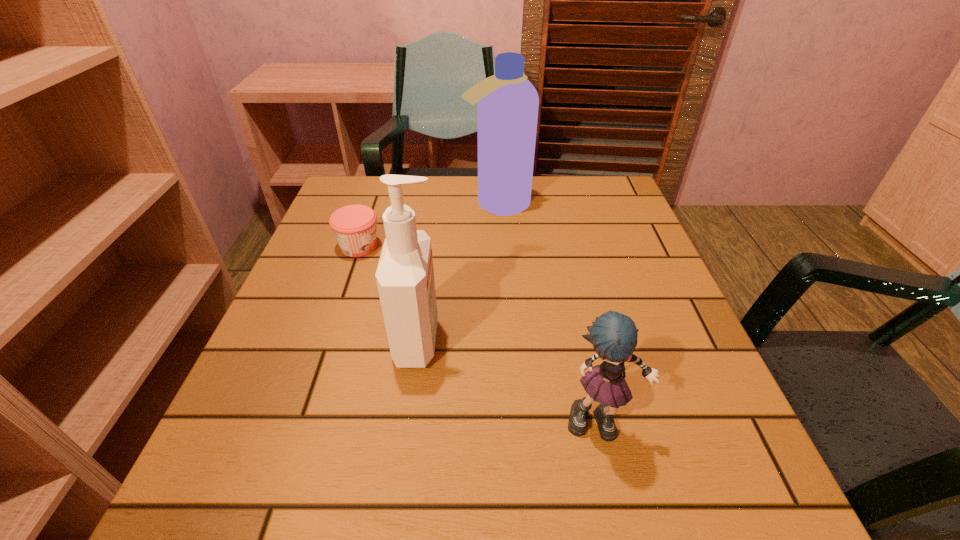
Locate an element on the screen. The image size is (960, 540). free space between the farthest object and the third farthest object is located at coordinates (458, 273).

You are a GUI agent. You are given a task and a screenshot of the screen. Output one action in this format:
    pyautogui.click(x=<x>, y=<y>)
    Task: Click on the free area in between the second nearest object and the farthest object
    This screenshot has width=960, height=540.
    Given the screenshot: What is the action you would take?
    pyautogui.click(x=458, y=273)

Where is `free spot between the farthest object and the nearest object`? free spot between the farthest object and the nearest object is located at coordinates (549, 313).

Locate an element on the screen. This screenshot has height=540, width=960. free space between the shortest object and the nearest object is located at coordinates [x=480, y=334].

Image resolution: width=960 pixels, height=540 pixels. What are the coordinates of `unoccupied position between the third farthest object and the shampoo` in the screenshot? It's located at (458, 273).

This screenshot has width=960, height=540. I want to click on free space between the shampoo and the second farthest object, so click(x=428, y=225).

Identify the location of blank region between the farthest object and the cleansing agent. The image size is (960, 540). (458, 273).

Where is `free space that is in between the second object from left to right and the shampoo`? free space that is in between the second object from left to right and the shampoo is located at coordinates (458, 273).

This screenshot has height=540, width=960. I want to click on vacant point located between the shampoo and the rag doll, so click(549, 313).

Identify the location of object that is the closest one to the leftmost object. The image size is (960, 540). (405, 280).